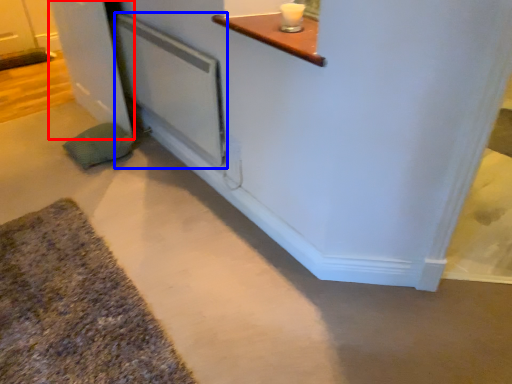
Question: Which object is further to the camera taking this photo, door (highlighted by a red box) or screen door (highlighted by a blue box)?

Choices:
 (A) door
 (B) screen door

Answer: (A)